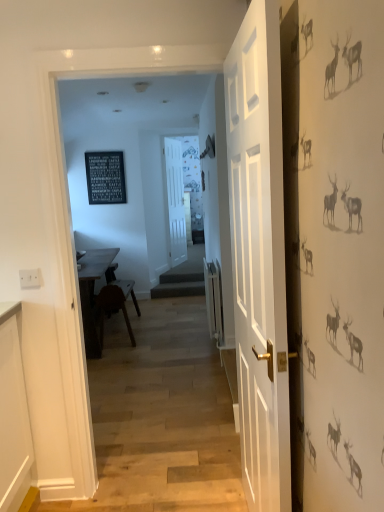
Question: Is white matte door at center, the 2th door viewed from the right, taller or shorter than wooden table at center?

Choices:
 (A) tall
 (B) short

Answer: (A)

Question: From the image's perspective, is white matte door at center, the 2th door viewed from the right, located above or below wooden table at center?

Choices:
 (A) below
 (B) above

Answer: (B)

Question: Which object is the farthest from the black slate sign at upper center?

Choices:
 (A) wooden table at center
 (B) white matte door at center, the first door positioned from the left
 (C) white wooden door at center, the 2th door when ordered from back to front

Answer: (C)

Question: Estimate the real-world distances between objects in this image. Which object is closer to the white matte door at center, the 2th door viewed from the right?

Choices:
 (A) wooden table at center
 (B) black slate sign at upper center
 (C) white wooden door at center, which is the first door from front to back

Answer: (B)